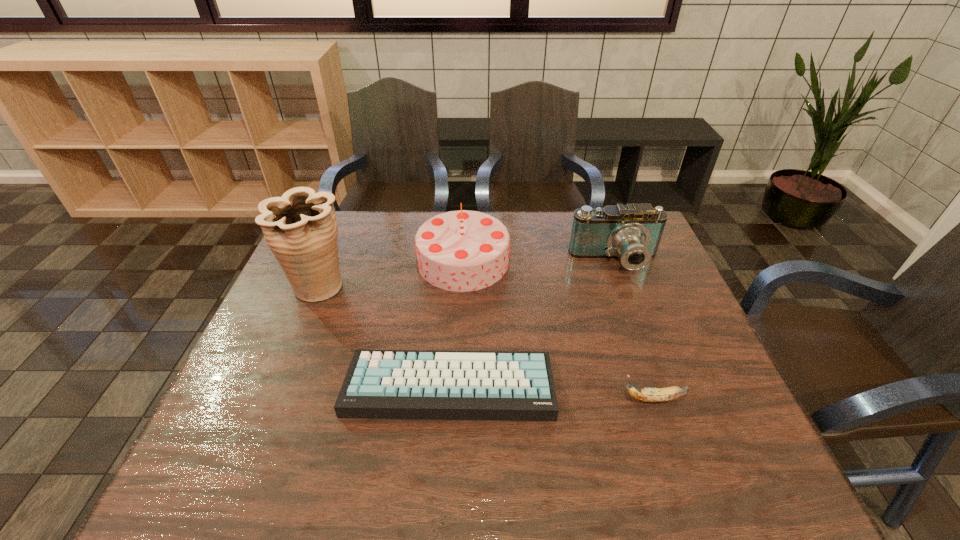
In order to click on free region at the near edge in this screenshot , I will do `click(457, 467)`.

Image resolution: width=960 pixels, height=540 pixels. Identify the location of vacant space at the left edge. (281, 323).

Image resolution: width=960 pixels, height=540 pixels. What are the coordinates of `vacant space at the right edge` in the screenshot? It's located at (659, 272).

This screenshot has height=540, width=960. In order to click on vacant space at the far left corner of the desktop in this screenshot , I will do `click(339, 245)`.

At what (x,y) coordinates should I click in order to perform the action: click on vacant region at the near left corner of the desktop. Please return your answer as a coordinate pair (x, y). Looking at the image, I should click on (223, 478).

The image size is (960, 540). In order to click on vacant space in between the third shortest object and the shortest object in this screenshot , I will do `click(533, 323)`.

This screenshot has width=960, height=540. In order to click on free space between the tallest object and the birthday cake in this screenshot , I will do `click(392, 273)`.

Image resolution: width=960 pixels, height=540 pixels. In order to click on empty space between the shortest object and the birthday cake in this screenshot , I will do `click(456, 323)`.

The image size is (960, 540). Identify the location of free space between the shortest object and the camcorder. (533, 323).

You are a GUI agent. You are given a task and a screenshot of the screen. Output one action in this format:
    pyautogui.click(x=<x>, y=<y>)
    Task: Click on the vacant space that's between the urn and the birthday cake
    
    Given the screenshot: What is the action you would take?
    pyautogui.click(x=392, y=273)